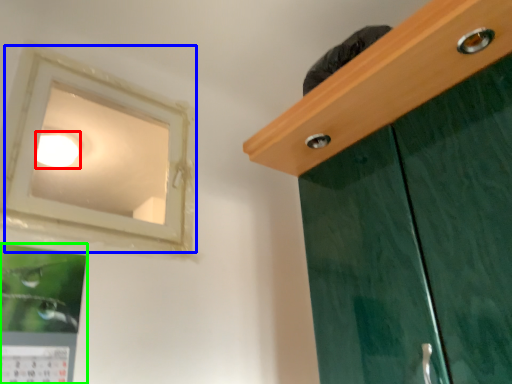
Question: Which is nearer to the lighting (highlighted by a red box)? window (highlighted by a blue box) or picture frame (highlighted by a green box).

Choices:
 (A) window
 (B) picture frame

Answer: (A)